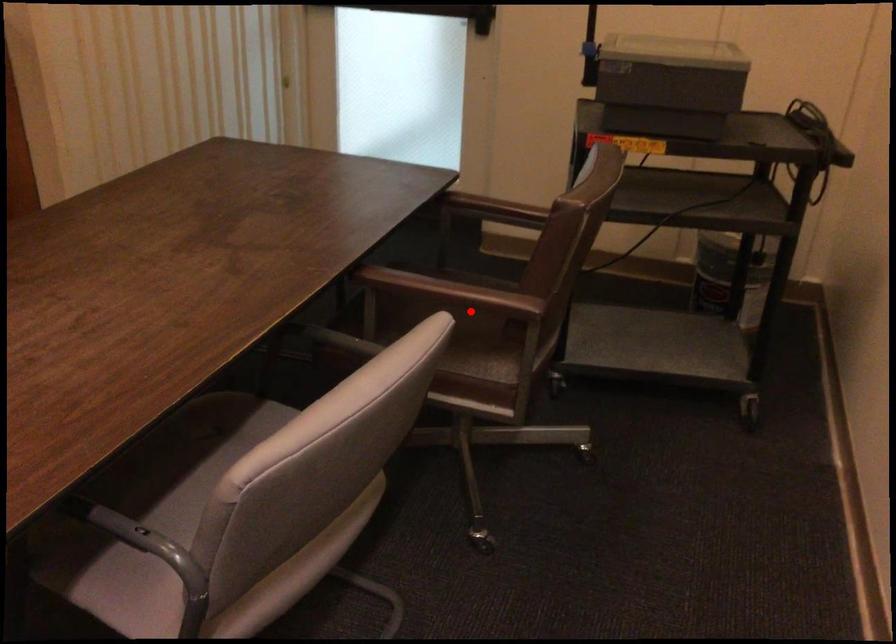
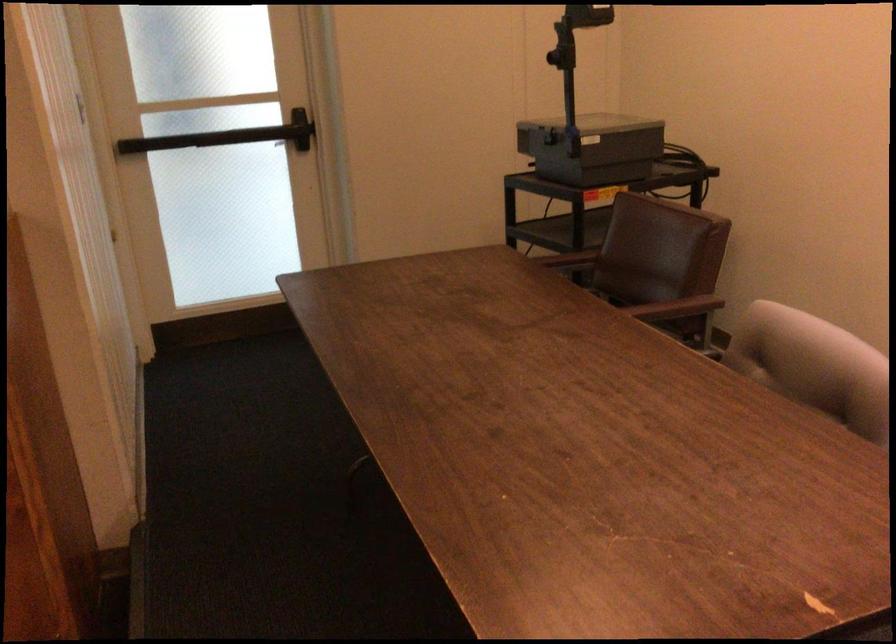
Question: I am providing you with two images of the same scene from different viewpoints. Image1 has a red point marked. In image2, the corresponding 3D location appears at what relative position? Reply with the corresponding letter.

Choices:
 (A) Closer
 (B) Farther

Answer: (B)